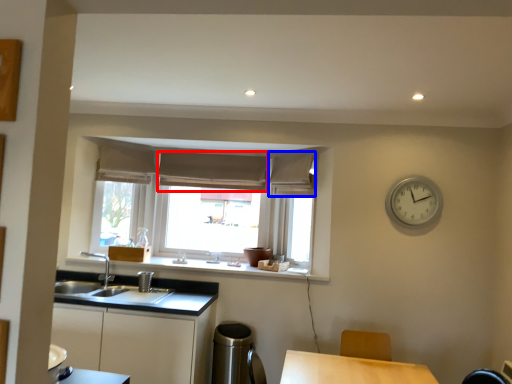
Question: Which object appears closest to the camera in this image, curtain (highlighted by a red box) or curtain (highlighted by a blue box)?

Choices:
 (A) curtain
 (B) curtain

Answer: (B)